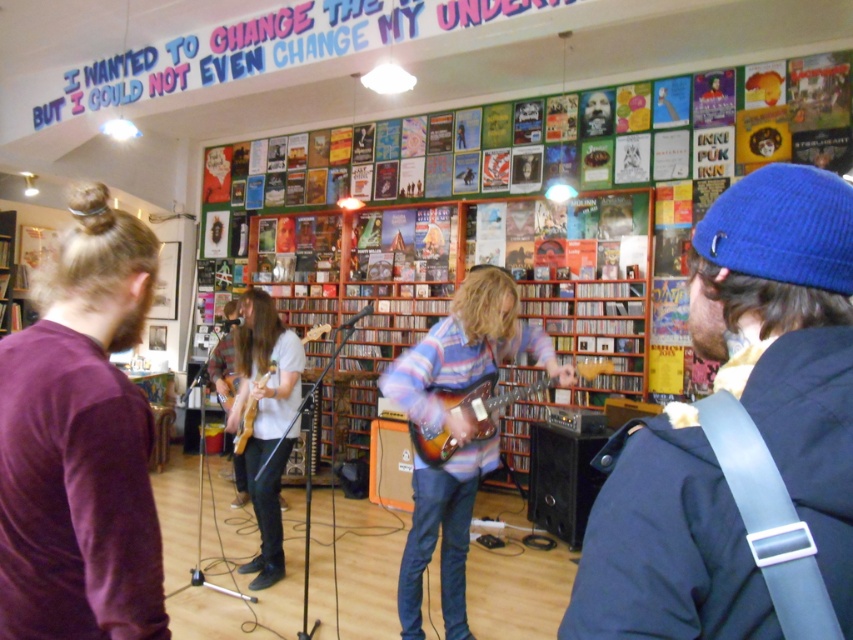
You are standing at the entrance of the music venue and want to place a 3 meter long banner between the blue knit beanie at upper right and the white matte shirt at center. Can the banner fit between them?

The blue knit beanie at upper right is 3.11 meters from the white matte shirt at center, so the 3 meter long banner can fit between them as there is enough space.

You are a photographer setting up for a concert photo shoot. You need to position a spotlight so that it illuminates both the blue knit beanie at upper right and the white matte shirt at center. Given their heights, which object should the spotlight be aimed higher to reach?

The spotlight should be aimed higher to reach the white matte shirt at center because it is taller than the blue knit beanie at upper right.

You are a photographer standing at the back of the room. You want to take a photo of the purple soft sweater at left without moving any objects. Can you capture it clearly in your shot?

The purple soft sweater at left is 3.49 feet away from the camera, so yes, it is within a reasonable distance to capture clearly without needing to move any objects.